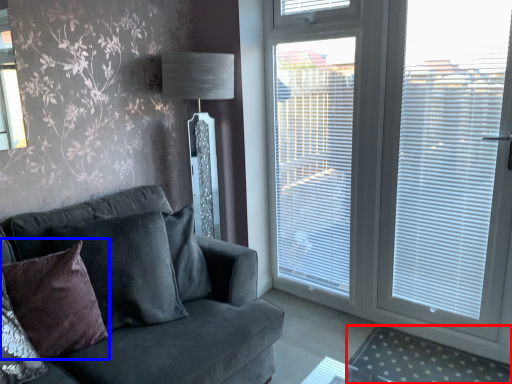
Question: Which of the following is the farthest to the observer, plain (highlighted by a red box) or pillow (highlighted by a blue box)?

Choices:
 (A) plain
 (B) pillow

Answer: (A)